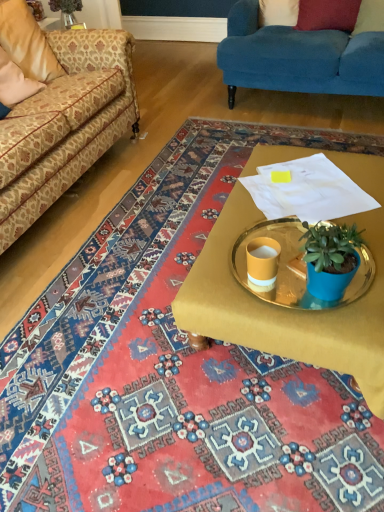
Question: From a real-world perspective, is gold metallic tray at center physically located above or below velvet red pillow at upper right, positioned as the 4th pillow in left-to-right order?

Choices:
 (A) below
 (B) above

Answer: (A)

Question: Relative to velvet red pillow at upper right, which is counted as the first pillow, starting from the right, is gold metallic tray at center in front or behind?

Choices:
 (A) front
 (B) behind

Answer: (A)

Question: Estimate the real-world distances between objects in this image. Which object is closer to the velvet red pillow at upper right, positioned as the 4th pillow in left-to-right order?

Choices:
 (A) matte yellow cup at center
 (B) gold metallic tray at center
 (C) red velvet pillow at upper right, the 3th pillow when ordered from left to right
 (D) white fabric pillow at upper center, marked as the 2th pillow in a left-to-right arrangement
 (E) velvet blue couch at upper right, which appears as the 1th studio couch when viewed from the right

Answer: (C)

Question: Estimate the real-world distances between objects in this image. Which object is farther from the beige fabric pillow at upper left, which is counted as the fourth pillow, starting from the right?

Choices:
 (A) gold metallic tray at center
 (B) red velvet pillow at upper right, placed as the 2th pillow when sorted from right to left
 (C) patterned fabric couch at left, marked as the first studio couch in a left-to-right arrangement
 (D) matte yellow cup at center
 (E) gold metallic tray at center

Answer: (D)